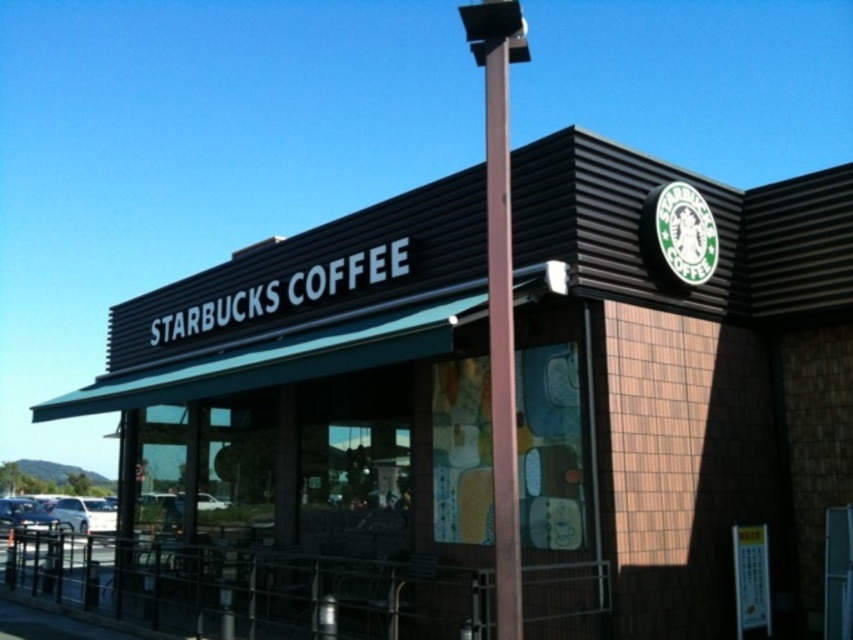
You are a photographer wanting to capture the Starbucks Coffee shop exterior. You notice the brown wood pole at center and the white matte car at lower left in your shot. Which object appears thinner in the photo?

The brown wood pole at center appears thinner because it has a lesser width compared to the white matte car at lower left.

You are standing at the entrance of the Starbucks Coffee shop and want to take a photo of the white matte car at lower left. The camera you have can focus on objects up to 30 meters away. Will the car be in focus?

The white matte car at lower left and camera are 27.82 meters apart from each other, so the car is within the camera focus range of 30 meters. Therefore, the car will be in focus.